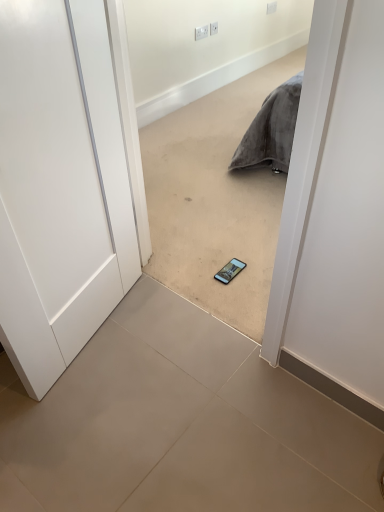
Question: Does point (206, 31) appear closer or farther from the camera than point (213, 33)?

Choices:
 (A) farther
 (B) closer

Answer: (B)

Question: From the image's perspective, is white plastic electric outlet at upper center, which appears as the first electric outlet when viewed from the left, located above or below white plastic electric outlet at upper center, arranged as the first electric outlet when viewed from the right?

Choices:
 (A) below
 (B) above

Answer: (A)

Question: Estimate the real-world distances between objects in this image. Which object is closer to the white plastic electric outlet at upper center, which appears as the first electric outlet when viewed from the left?

Choices:
 (A) white matte door at left
 (B) matte gray tile at center
 (C) white plastic electric outlet at upper center, arranged as the first electric outlet when viewed from the right
 (D) smooth beige carpet at center

Answer: (C)

Question: Considering the real-world distances, which object is closest to the smooth beige carpet at center?

Choices:
 (A) white plastic electric outlet at upper center, which appears as the first electric outlet when viewed from the left
 (B) white matte door at left
 (C) matte gray tile at center
 (D) white plastic electric outlet at upper center, arranged as the first electric outlet when viewed from the right

Answer: (C)